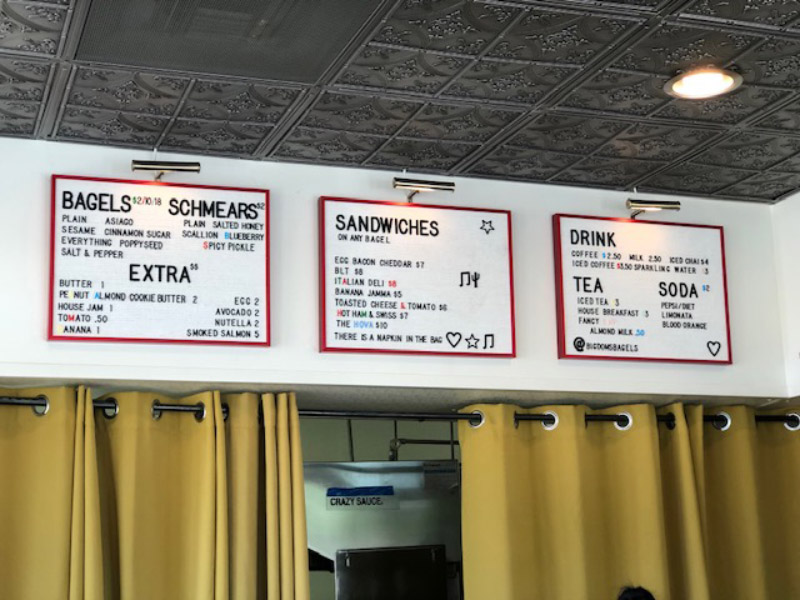
Where is `light`? Image resolution: width=800 pixels, height=600 pixels. light is located at coordinates (174, 163), (421, 179), (650, 202).